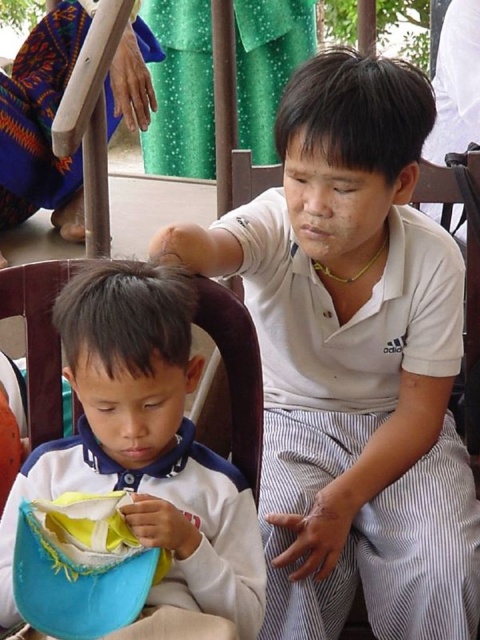
Between point (197, 516) and point (68, 600), which one is positioned in front?

Point (68, 600) is in front.

Image resolution: width=480 pixels, height=640 pixels. Describe the element at coordinates (145, 444) in the screenshot. I see `white soft fabric at center` at that location.

Image resolution: width=480 pixels, height=640 pixels. I want to click on white soft fabric at center, so tap(145, 444).

Who is taller, white matte shirt at upper center or soft yellow fabric at lower left?

Standing taller between the two is white matte shirt at upper center.

Which is in front, point (368, 282) or point (99, 563)?

Point (99, 563) is more forward.

This screenshot has height=640, width=480. I want to click on white matte shirt at upper center, so point(354,362).

Between white matte shirt at upper center and white soft fabric at center, which one is positioned lower?

white soft fabric at center is below.

Is point (282, 566) behind point (211, 612)?

Yes, point (282, 566) is farther from viewer.

You are a GUI agent. You are given a task and a screenshot of the screen. Output one action in this format:
    pyautogui.click(x=<x>, y=<y>)
    Task: Click on the white matte shirt at upper center
    This screenshot has width=480, height=640.
    Given the screenshot: What is the action you would take?
    pyautogui.click(x=354, y=362)

You are a GUI agent. You are given a task and a screenshot of the screen. Output one action in this format:
    pyautogui.click(x=<x>, y=<y>)
    Task: Click on the white matte shirt at upper center
    The height and width of the screenshot is (640, 480).
    Given the screenshot: What is the action you would take?
    pyautogui.click(x=354, y=362)